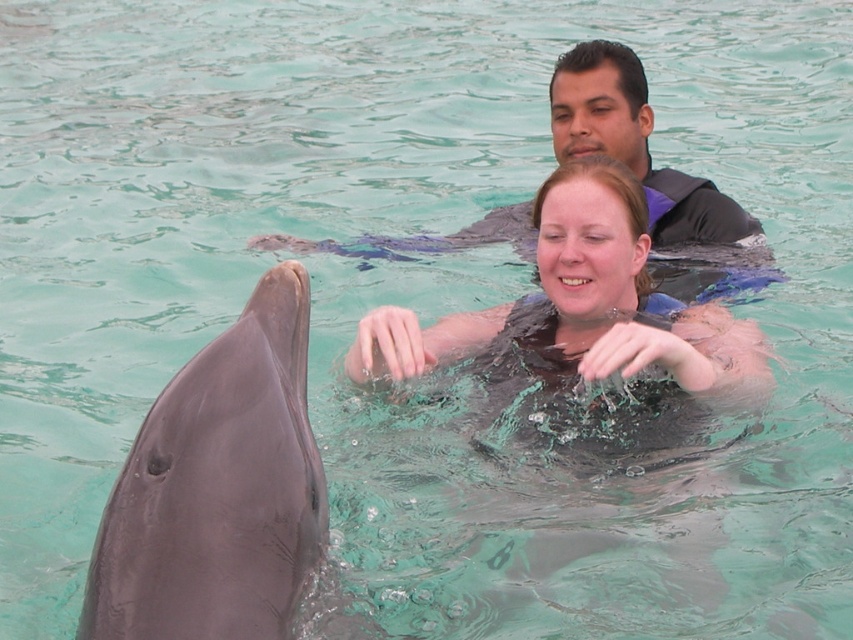
Question: Does gray smooth dolphin at left have a larger size compared to black matte wetsuit at center?

Choices:
 (A) no
 (B) yes

Answer: (A)

Question: Estimate the real-world distances between objects in this image. Which object is farther from the smooth black wetsuit at upper center?

Choices:
 (A) gray smooth dolphin at left
 (B) black matte wetsuit at center

Answer: (A)

Question: Which object is closer to the camera taking this photo?

Choices:
 (A) gray smooth dolphin at left
 (B) smooth black wetsuit at upper center
 (C) black matte wetsuit at center

Answer: (A)

Question: Is gray smooth dolphin at left thinner than smooth black wetsuit at upper center?

Choices:
 (A) yes
 (B) no

Answer: (A)

Question: Which point is farther to the camera?

Choices:
 (A) (218, 403)
 (B) (604, 136)
 (C) (524, 336)

Answer: (B)

Question: Can you confirm if gray smooth dolphin at left is positioned above smooth black wetsuit at upper center?

Choices:
 (A) no
 (B) yes

Answer: (A)